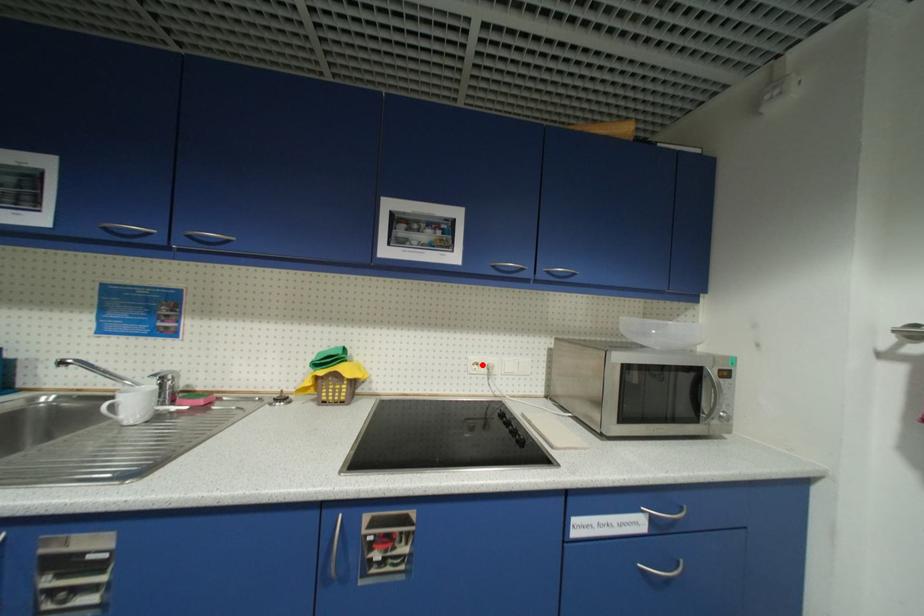
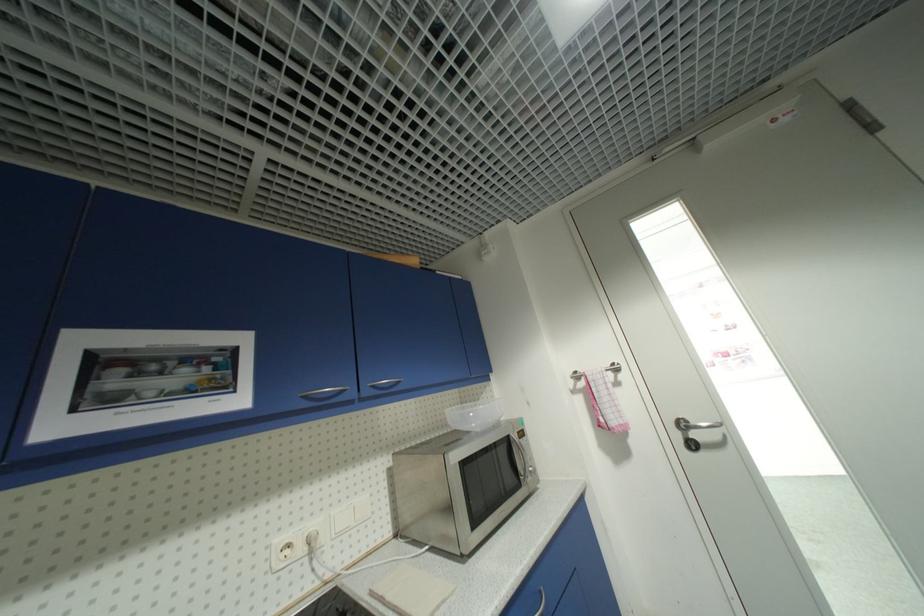
Locate, in the second image, the point that corresponds to the highlighted location in the first image.

(294, 546)